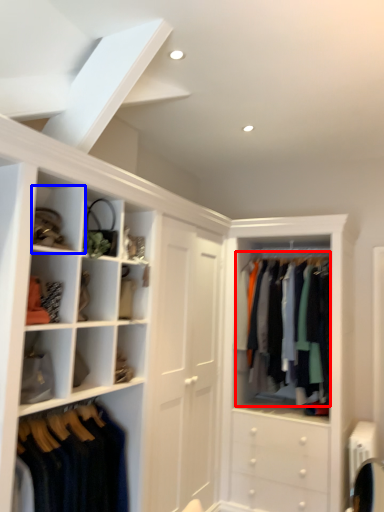
Question: Which object appears closest to the camera in this image, clothing (highlighted by a red box) or cabinet (highlighted by a blue box)?

Choices:
 (A) clothing
 (B) cabinet

Answer: (B)